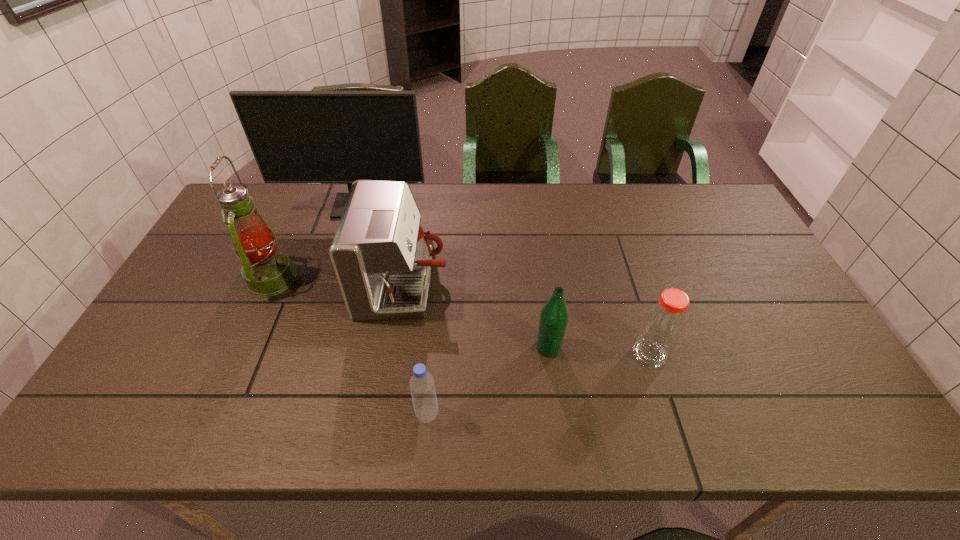
Locate an element on the screen. computer monitor is located at coordinates (296, 136).

At what (x,y) coordinates should I click in order to perform the action: click on oil lamp. Please return your answer as a coordinate pair (x, y). The image size is (960, 540). Looking at the image, I should click on (267, 272).

You are a GUI agent. You are given a task and a screenshot of the screen. Output one action in this format:
    pyautogui.click(x=<x>, y=<y>)
    Task: Click on the coffee maker
    This screenshot has height=540, width=960.
    Given the screenshot: What is the action you would take?
    pyautogui.click(x=383, y=262)

This screenshot has width=960, height=540. What are the coordinates of `the fifth object from left to right` in the screenshot? It's located at (554, 315).

Image resolution: width=960 pixels, height=540 pixels. In order to click on the rightmost bottle in this screenshot , I will do pyautogui.click(x=663, y=324).

Where is `the leftmost bottle`? The width and height of the screenshot is (960, 540). the leftmost bottle is located at coordinates (422, 386).

Locate an element on the screen. This screenshot has width=960, height=540. the shortest object is located at coordinates (x=422, y=386).

Locate an element on the screen. The height and width of the screenshot is (540, 960). free space located on the front-facing side of the computer monitor is located at coordinates (337, 265).

Where is `free location located on the right of the oil lamp`? Image resolution: width=960 pixels, height=540 pixels. free location located on the right of the oil lamp is located at coordinates (420, 279).

At what (x,y) coordinates should I click in order to perform the action: click on free region located on the front of the coffee maker near the spout. Please return your answer as a coordinate pair (x, y). Looking at the image, I should click on (540, 286).